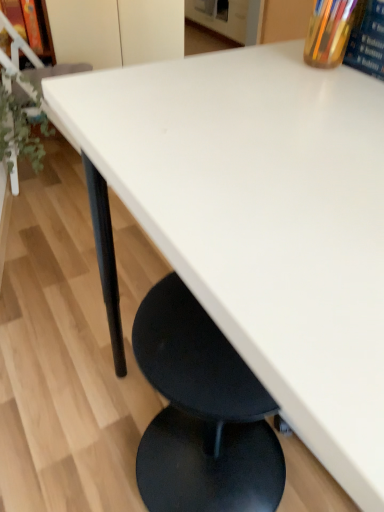
Question: Can you confirm if green leafy plant at left is thinner than matte wood shelf at upper left?

Choices:
 (A) yes
 (B) no

Answer: (B)

Question: Does green leafy plant at left come behind matte wood shelf at upper left?

Choices:
 (A) no
 (B) yes

Answer: (A)

Question: Is green leafy plant at left outside of matte wood shelf at upper left?

Choices:
 (A) yes
 (B) no

Answer: (A)

Question: Is green leafy plant at left at the left side of matte wood shelf at upper left?

Choices:
 (A) yes
 (B) no

Answer: (B)

Question: Does green leafy plant at left have a lesser height compared to matte wood shelf at upper left?

Choices:
 (A) yes
 (B) no

Answer: (B)

Question: Considering the positions of point (331, 4) and point (374, 70), is point (331, 4) closer or farther from the camera than point (374, 70)?

Choices:
 (A) farther
 (B) closer

Answer: (B)

Question: From a real-world perspective, is translucent glass pen holder at upper right physically located above or below hardcover book at upper right?

Choices:
 (A) above
 (B) below

Answer: (A)

Question: Considering their positions, is translucent glass pen holder at upper right located in front of or behind hardcover book at upper right?

Choices:
 (A) behind
 (B) front

Answer: (A)

Question: Would you say translucent glass pen holder at upper right is to the left or to the right of hardcover book at upper right in the picture?

Choices:
 (A) right
 (B) left

Answer: (B)

Question: Based on their sizes in the image, would you say hardcover book at upper right is bigger or smaller than matte wood shelf at upper left?

Choices:
 (A) small
 (B) big

Answer: (A)

Question: Visually, is hardcover book at upper right positioned to the left or to the right of matte wood shelf at upper left?

Choices:
 (A) left
 (B) right

Answer: (B)

Question: Is point (360, 56) closer or farther from the camera than point (44, 38)?

Choices:
 (A) farther
 (B) closer

Answer: (B)

Question: From the image's perspective, is hardcover book at upper right located above or below matte wood shelf at upper left?

Choices:
 (A) above
 (B) below

Answer: (B)

Question: Is green leafy plant at left bigger or smaller than hardcover book at upper right?

Choices:
 (A) big
 (B) small

Answer: (A)

Question: Considering the positions of green leafy plant at left and hardcover book at upper right in the image, is green leafy plant at left taller or shorter than hardcover book at upper right?

Choices:
 (A) tall
 (B) short

Answer: (A)